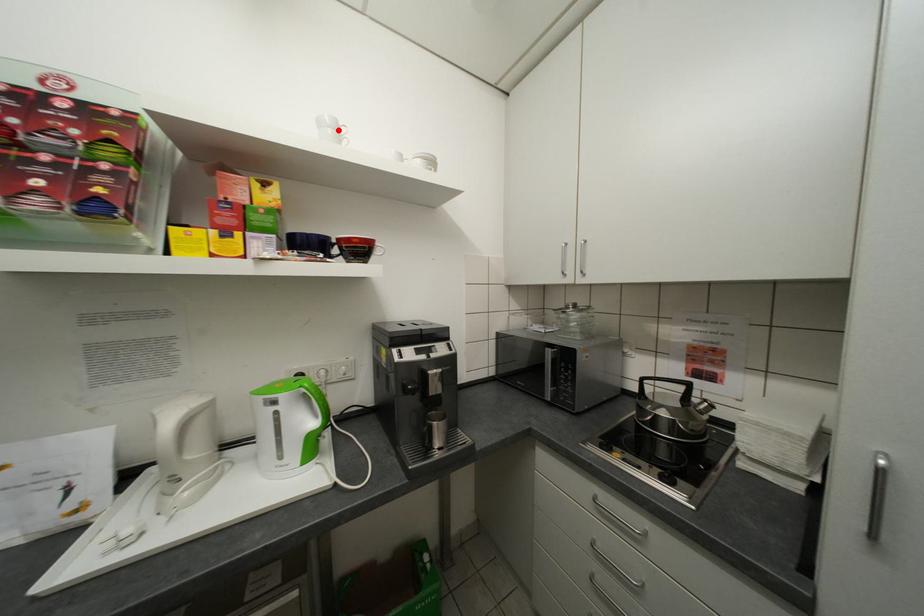
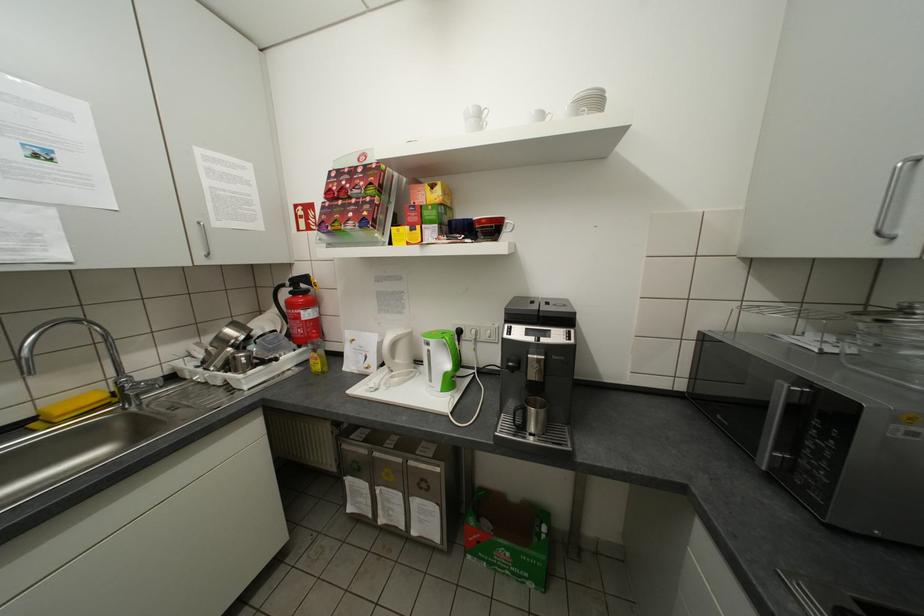
The point at the highlighted location is marked in the first image. Where is the corresponding point in the second image?

(481, 120)